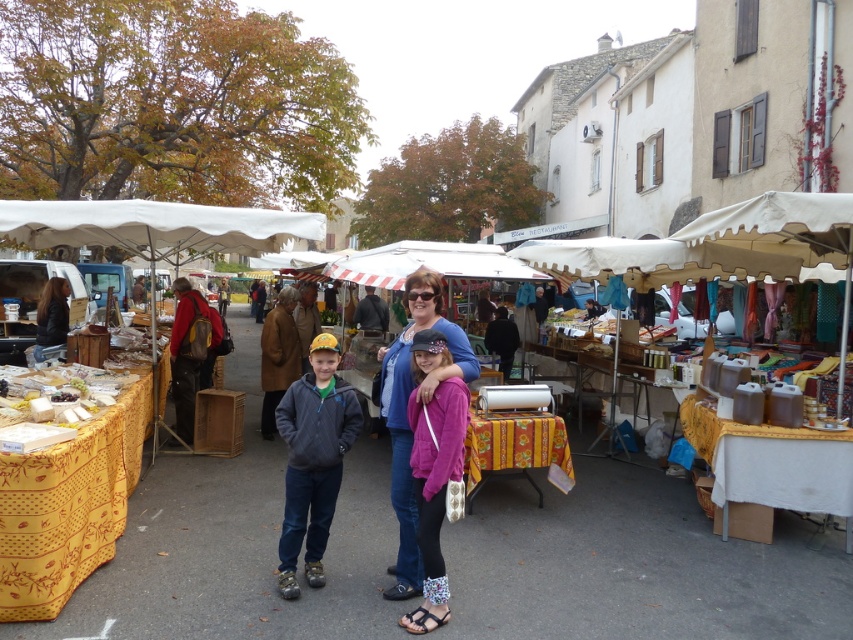
Is point (776, 625) farther from viewer compared to point (322, 220)?

That is False.

What do you see at coordinates (634, 564) in the screenshot? I see `yellow fabric tablecloth at center` at bounding box center [634, 564].

This screenshot has height=640, width=853. I want to click on yellow fabric tablecloth at center, so click(634, 564).

Who is higher up, yellow fabric tablecloth at center or blue cotton shirt at center?

Positioned higher is blue cotton shirt at center.

Is yellow fabric tablecloth at center smaller than blue cotton shirt at center?

Actually, yellow fabric tablecloth at center might be larger than blue cotton shirt at center.

Identify the location of yellow fabric tablecloth at center. (634, 564).

Locate an element on the screen. This screenshot has width=853, height=640. yellow fabric tablecloth at center is located at coordinates (634, 564).

Does matte blue sweater at center appear over dark brown leather jacket at left?

No, matte blue sweater at center is not above dark brown leather jacket at left.

Can you confirm if matte blue sweater at center is wider than dark brown leather jacket at left?

No, matte blue sweater at center is not wider than dark brown leather jacket at left.

Is point (422, 326) positioned behind point (39, 323)?

No.

You are a GUI agent. You are given a task and a screenshot of the screen. Output one action in this format:
    pyautogui.click(x=<x>, y=<y>)
    Task: Click on the matte blue sweater at center
    This screenshot has height=640, width=853.
    Given the screenshot: What is the action you would take?
    pyautogui.click(x=405, y=412)